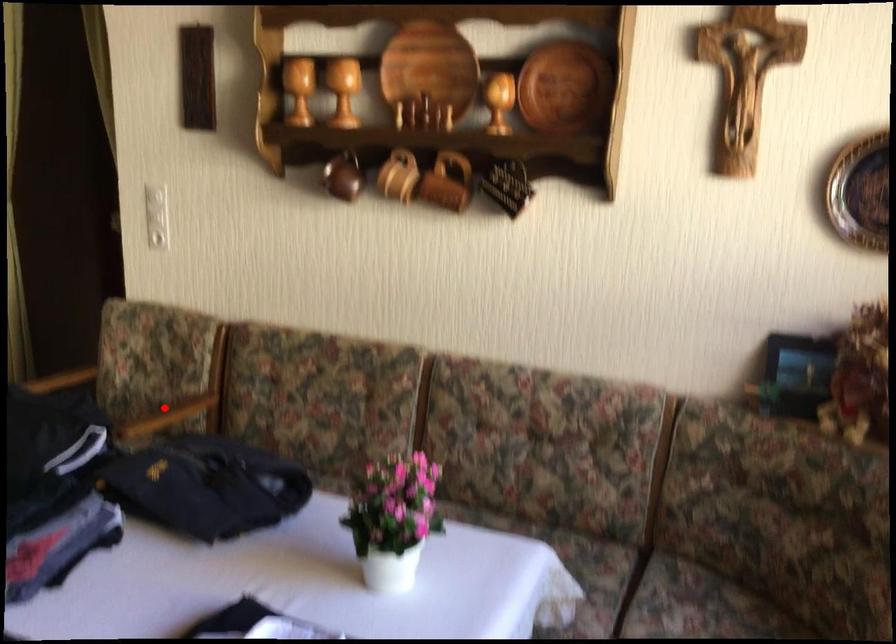
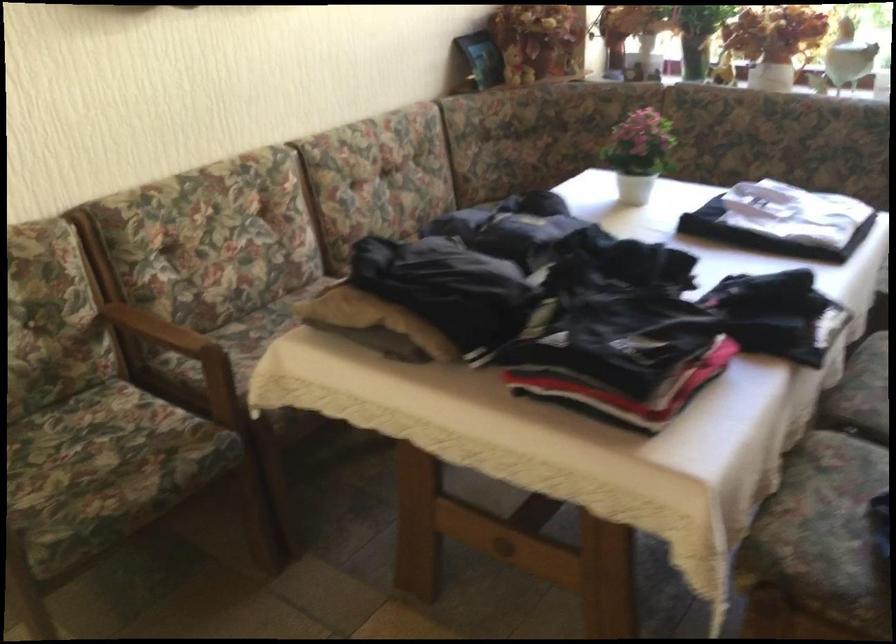
Locate, in the second image, the point that corresponds to the highlighted location in the first image.

(158, 328)